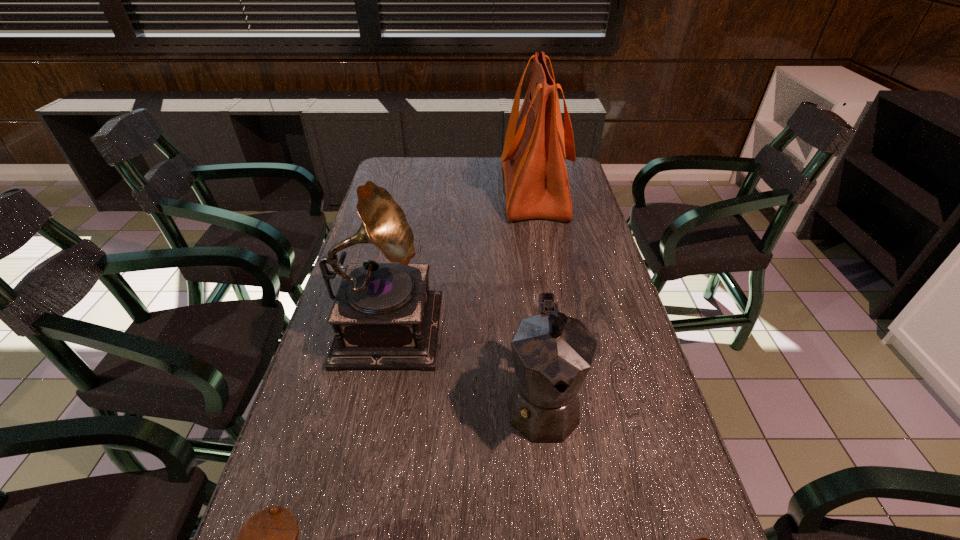
The image size is (960, 540). In order to click on shopping bag in this screenshot , I will do `click(536, 145)`.

I want to click on record player, so click(x=384, y=316).

This screenshot has height=540, width=960. I want to click on the third shortest object, so click(x=553, y=353).

The image size is (960, 540). What are the coordinates of `free space located 0.280m on the front pocket of the shopping bag` in the screenshot? It's located at pos(424,191).

Identify the location of vacant space located on the front pocket of the shopping bag. (397, 191).

This screenshot has width=960, height=540. In order to click on free location located on the front pocket of the shopping bag in this screenshot , I will do `click(405, 191)`.

Where is `free space located 0.330m on the horn of the record player`? The image size is (960, 540). free space located 0.330m on the horn of the record player is located at coordinates (567, 322).

At what (x,y) coordinates should I click in order to perform the action: click on free location located on the pouring side of the third shortest object. Please return your answer as a coordinate pair (x, y). The height and width of the screenshot is (540, 960). Looking at the image, I should click on (558, 528).

Locate an element on the screen. Image resolution: width=960 pixels, height=540 pixels. object located in the far edge section of the desktop is located at coordinates (536, 145).

Locate an element on the screen. The image size is (960, 540). object at the left edge is located at coordinates (384, 316).